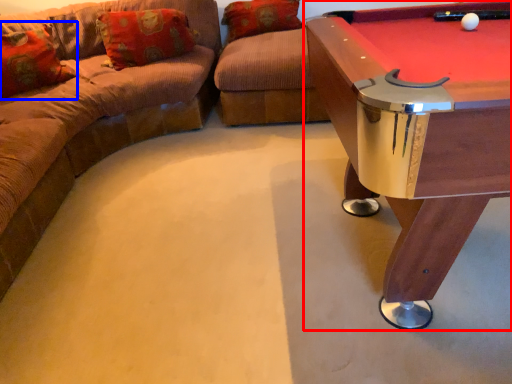
Question: Which of the following is the farthest to the observer, table (highlighted by a red box) or pillow (highlighted by a blue box)?

Choices:
 (A) table
 (B) pillow

Answer: (B)